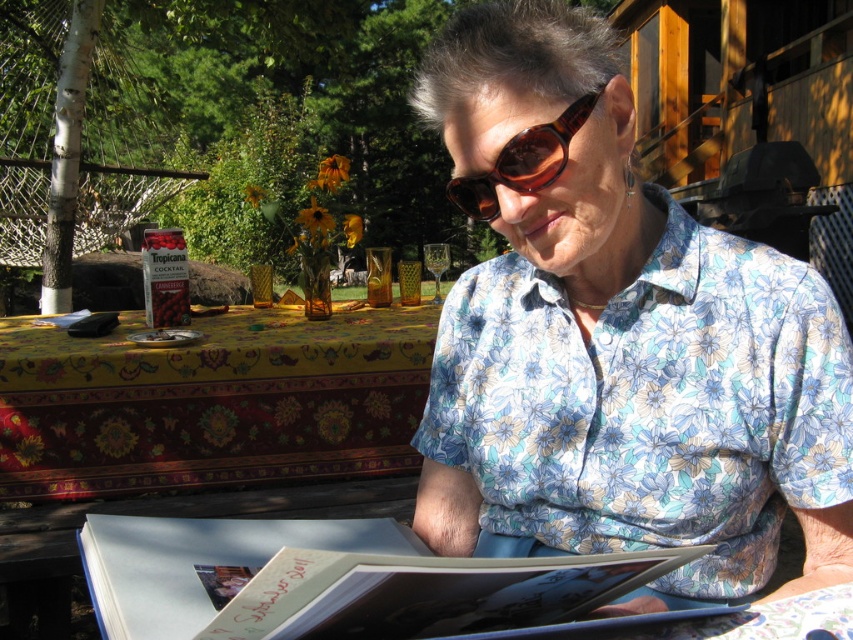
From the picture: Who is positioned more to the left, floral cotton shirt at center or yellow floral fabric at upper left?

From the viewer's perspective, yellow floral fabric at upper left appears more on the left side.

Is point (526, 244) more distant than point (7, 380)?

No, it is not.

Is point (489, 92) in front of point (0, 416)?

Yes, it is in front of point (0, 416).

Identify the location of floral cotton shirt at center. The image size is (853, 640). (616, 339).

From the picture: Who is positioned more to the right, yellow floral fabric at upper left or light blue paper book at center?

light blue paper book at center

I want to click on yellow floral fabric at upper left, so click(212, 401).

Identify the location of yellow floral fabric at upper left. The image size is (853, 640). (212, 401).

Does floral cotton shirt at center have a lesser height compared to brown tortoiseshell sunglasses at center?

No.

Does point (666, 461) lie behind point (514, 147)?

Yes, point (666, 461) is farther from viewer.

You are a GUI agent. You are given a task and a screenshot of the screen. Output one action in this format:
    pyautogui.click(x=<x>, y=<y>)
    Task: Click on the floral cotton shirt at center
    The width and height of the screenshot is (853, 640).
    Given the screenshot: What is the action you would take?
    pyautogui.click(x=616, y=339)

At what (x,y) coordinates should I click in order to perform the action: click on floral cotton shirt at center. Please return your answer as a coordinate pair (x, y). Image resolution: width=853 pixels, height=640 pixels. Looking at the image, I should click on (616, 339).